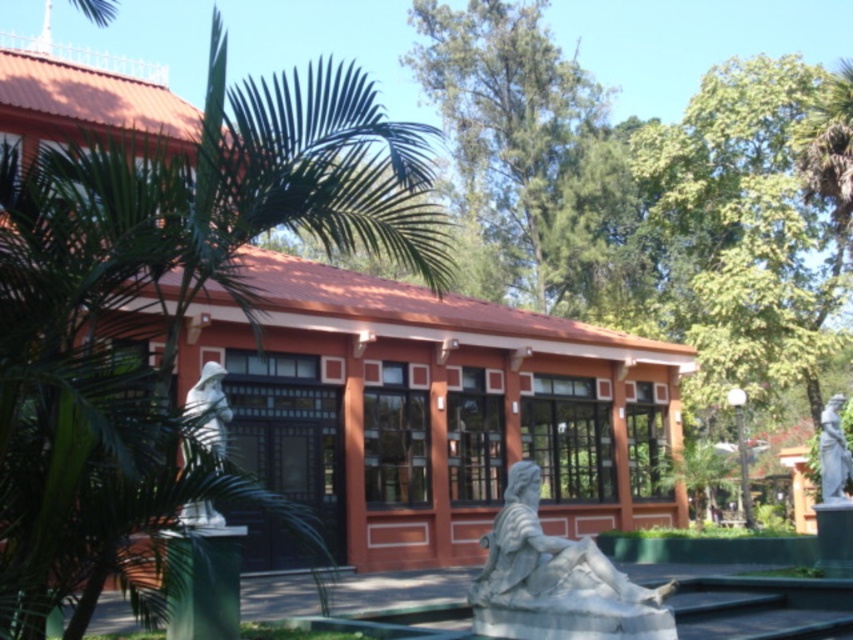
You are a landscape architect designing a new garden path that must pass between the green leafy tree at upper center and the white marble statue at left. What is the minimum width the path should be to ensure there is at least 10 meters of clearance between them?

The green leafy tree at upper center and white marble statue at left are 32.14 meters apart. To ensure at least 10 meters of clearance between them, the path should be at least 10 meters wide. However, since the distance between them is 32.14 meters, the path can be narrower than that as long as it maintains the required clearance. The minimum width would depend on the path alignment, but the clearance requirement is satisfied as long as the path stays within 10 meters from either object.

Consider the image. You are standing in front of the red brick building and want to take a photo of the green leafy palm tree at left and the green leafy tree at upper center. Which tree will appear larger in the photo?

The green leafy palm tree at left will appear larger in the photo because it is closer to the camera than the green leafy tree at upper center.